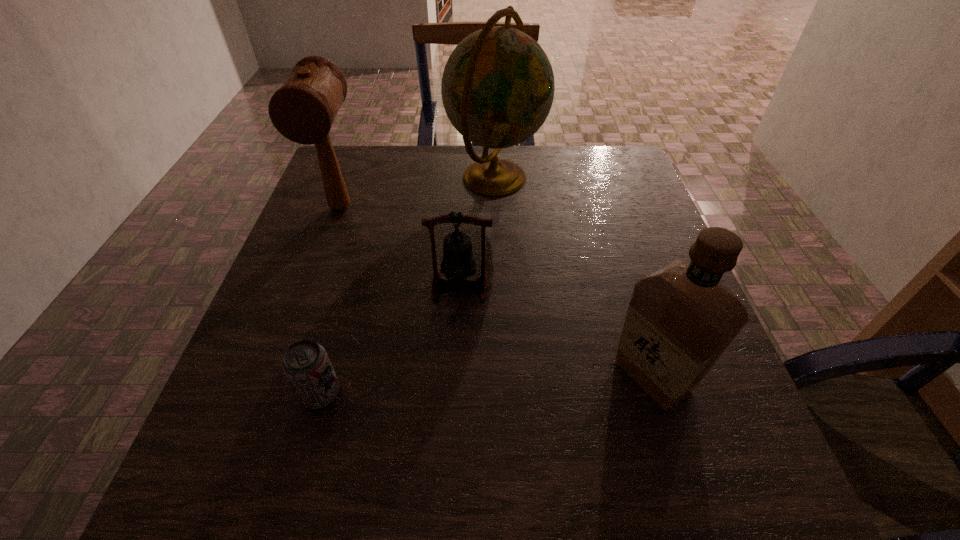
Find the location of a particular element. vacant space at the left edge of the desktop is located at coordinates (227, 452).

In the image, there is a desktop. At what (x,y) coordinates should I click in order to perform the action: click on free region at the right edge. Please return your answer as a coordinate pair (x, y). This screenshot has height=540, width=960. Looking at the image, I should click on pos(603,193).

Identify the location of vacant space at the far left corner of the desktop. (371, 150).

This screenshot has width=960, height=540. Find the location of `vacant space at the far right corner of the desktop`. vacant space at the far right corner of the desktop is located at coordinates (587, 151).

In the image, there is a desktop. Where is `blank space at the near right corner`? The width and height of the screenshot is (960, 540). blank space at the near right corner is located at coordinates (740, 473).

Where is `unoccupied area between the mallet and the third farthest object`? The width and height of the screenshot is (960, 540). unoccupied area between the mallet and the third farthest object is located at coordinates (400, 247).

Image resolution: width=960 pixels, height=540 pixels. What are the coordinates of `free space that is in between the mallet and the liquor` in the screenshot? It's located at (496, 292).

Image resolution: width=960 pixels, height=540 pixels. What are the coordinates of `vacant region between the bell and the globe` in the screenshot? It's located at (478, 232).

You are a GUI agent. You are given a task and a screenshot of the screen. Output one action in this format:
    pyautogui.click(x=<x>, y=<y>)
    Task: Click on the vacant space that is in between the tallest object and the bell
    
    Given the screenshot: What is the action you would take?
    pyautogui.click(x=478, y=232)

Locate an element on the screen. free space that is in between the beer can and the liquor is located at coordinates (487, 385).